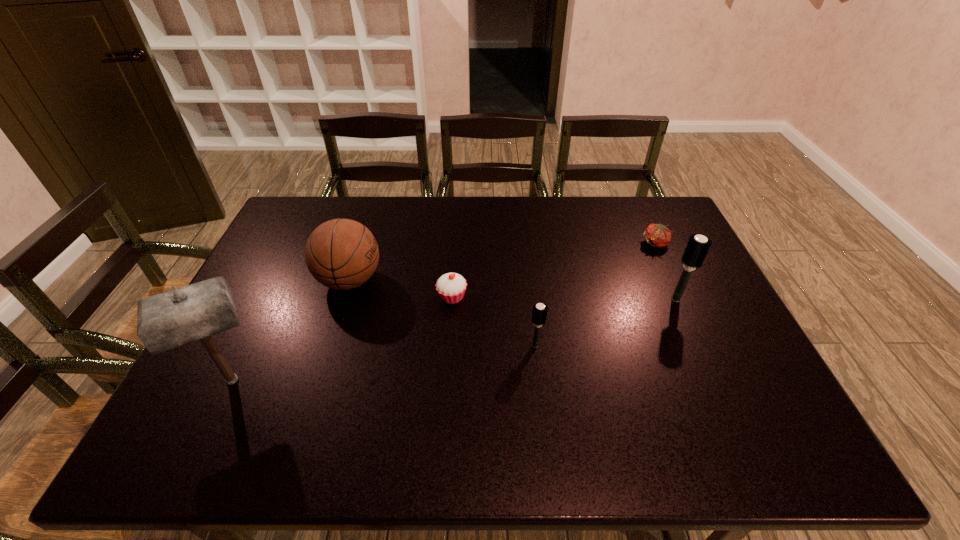
What are the coordinates of `vacant place for an extra hairbrush on the left` in the screenshot? It's located at (361, 403).